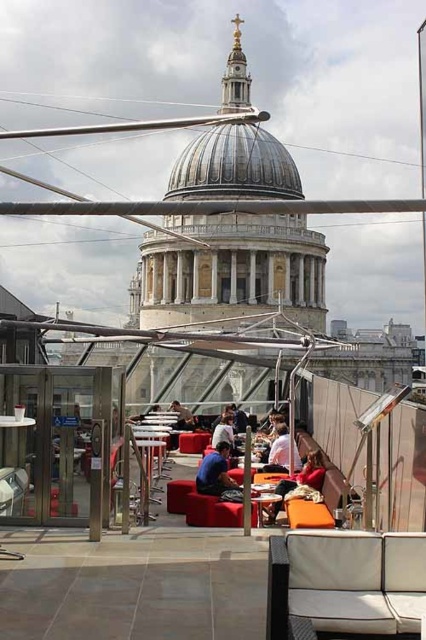
You are planning to place a large potted plant on the terrace. The potted plant requires a stable surface that is not obstructed by any other furniture. Which table, the metallic silver table at center or the wooden table at center, should you choose to place it on?

The metallic silver table at center is positioned over wooden table at center, so you should place the potted plant on the wooden table at center since it is the lower table and likely has more space available.

You are a guest at a rooftop event and want to place a tall flower vase on a table. Which table, the metallic silver table at center or the wooden table at center, would be more suitable for the vase?

The metallic silver table at center is much taller than the wooden table at center, so it would be more suitable for placing a tall flower vase.

You are a visitor standing on the rooftop terrace and want to sit down. You see the white fabric couch at center and the velvet red cushion at center. Which one is farther from you?

The white fabric couch at center is 47.98 feet from velvet red cushion at center, so the white fabric couch at center is farther away from you than the velvet red cushion at center.